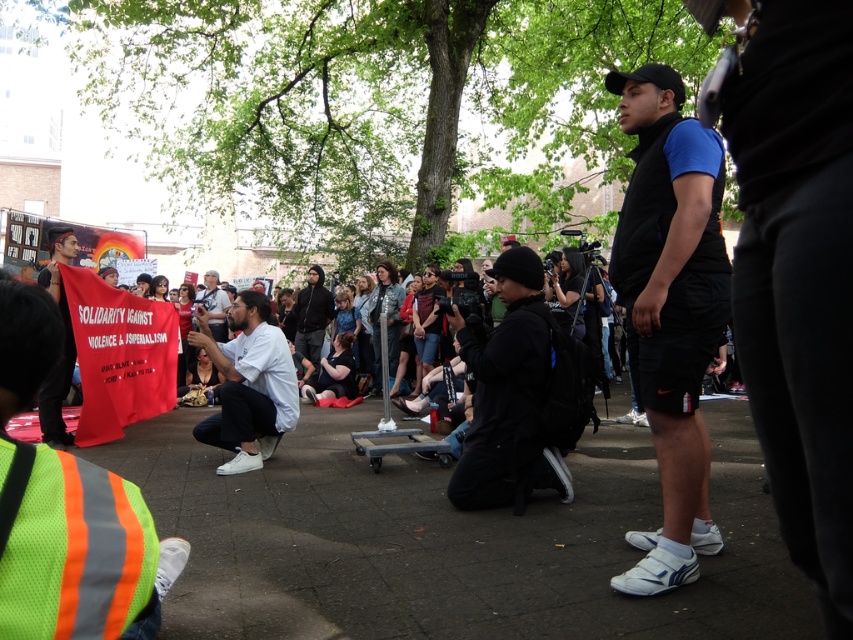
You are a photographer at the protest and want to capture both the blue fabric shirt at center and the white matte shirt at center in a single photo. Which shirt should you focus on to ensure both are in frame?

The blue fabric shirt at center is positioned over the white matte shirt at center, so focusing on the blue fabric shirt at center would ensure both are visible in the photo.

You are a photographer standing at the edge of the crowd. You want to take a photo that includes both the white matte shirt at center and the white shirt at center. Given that your camera has a maximum focus range of 5 meters, will you be able to capture both subjects in focus without moving closer?

The white matte shirt at center and the white shirt at center are 5.77 meters apart. Since the distance between them exceeds the camera maximum focus range of 5 meters, you will not be able to capture both subjects in focus without moving closer.

You are a photographer at the protest and want to capture both the black matte jacket at center and the white matte shirt at center in a single frame. Which object should you focus on first if you want to ensure both are in focus, considering their sizes?

The black matte jacket at center is taller than the white matte shirt at center. To ensure both are in focus, focus on the black matte jacket at center first since it is larger and requires more precise focus.